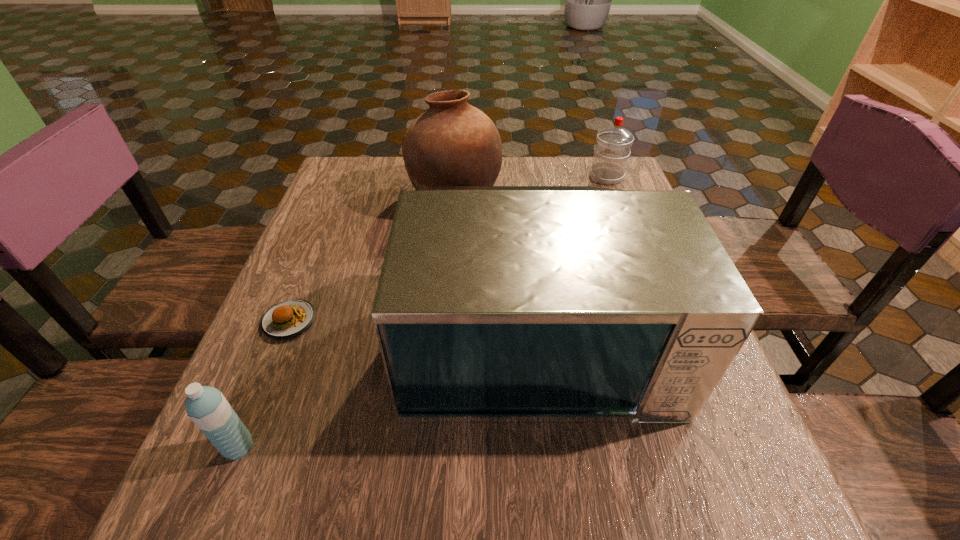
Locate an element on the screen. This screenshot has width=960, height=540. pottery is located at coordinates (453, 143).

This screenshot has width=960, height=540. Find the location of `microwave oven`. microwave oven is located at coordinates (495, 304).

Locate an element on the screen. Image resolution: width=960 pixels, height=540 pixels. the farther water bottle is located at coordinates (613, 145).

Find the location of a particular element. The height and width of the screenshot is (540, 960). the nearer water bottle is located at coordinates (208, 409).

Locate an element on the screen. The image size is (960, 540). the nearest object is located at coordinates point(208,409).

Where is `the shortest object`? The image size is (960, 540). the shortest object is located at coordinates (289, 318).

The height and width of the screenshot is (540, 960). What are the coordinates of `free space located on the right of the pottery` in the screenshot? It's located at (541, 197).

I want to click on free space located on the front-facing side of the microwave oven, so click(557, 516).

In order to click on free space located 0.060m on the handle side of the right water bottle in this screenshot , I will do `click(599, 157)`.

This screenshot has width=960, height=540. I want to click on vacant space located on the right of the left water bottle, so click(390, 448).